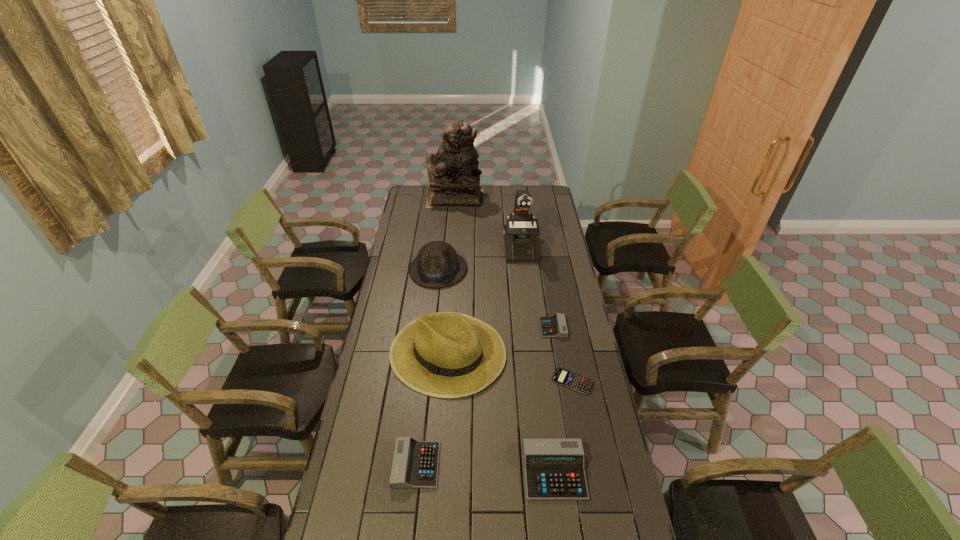
Where is `vacant space at the far right corner of the desktop`? The height and width of the screenshot is (540, 960). vacant space at the far right corner of the desktop is located at coordinates (549, 195).

You are a GUI agent. You are given a task and a screenshot of the screen. Output one action in this format:
    pyautogui.click(x=<x>, y=<y>)
    Task: Click on the vacant space that is in between the blue calculator and the sculpture
    
    Given the screenshot: What is the action you would take?
    pyautogui.click(x=514, y=290)

Where is `vacant area that lies between the fourth tallest object and the sunhat`? vacant area that lies between the fourth tallest object and the sunhat is located at coordinates (443, 311).

Where is `free spot between the farthest object and the fourth shortest object`? Image resolution: width=960 pixels, height=540 pixels. free spot between the farthest object and the fourth shortest object is located at coordinates (505, 335).

Where is `vacant space in between the second farthest calculator and the third tallest calculator`? The width and height of the screenshot is (960, 540). vacant space in between the second farthest calculator and the third tallest calculator is located at coordinates (563, 354).

Locate an element on the screen. vacant space in between the sculpture and the shortest object is located at coordinates (514, 290).

I want to click on vacant space that is in between the shortest object and the sunhat, so click(510, 367).

Locate an element on the screen. The height and width of the screenshot is (540, 960). blank region between the farthest calculator and the second biggest gray calculator is located at coordinates [x=485, y=396].

Locate an element on the screen. This screenshot has height=540, width=960. object identified as the second closest to the bowler hat is located at coordinates (521, 245).

This screenshot has width=960, height=540. What are the coordinates of `the third closest object relative to the sunhat` in the screenshot? It's located at (561, 376).